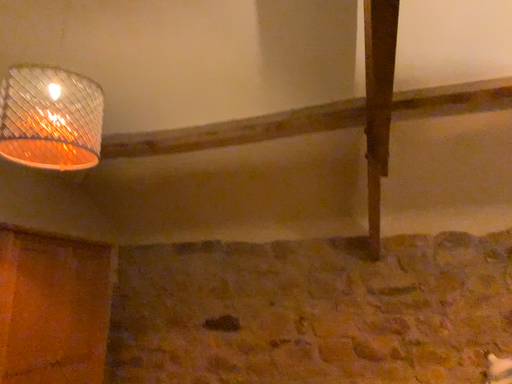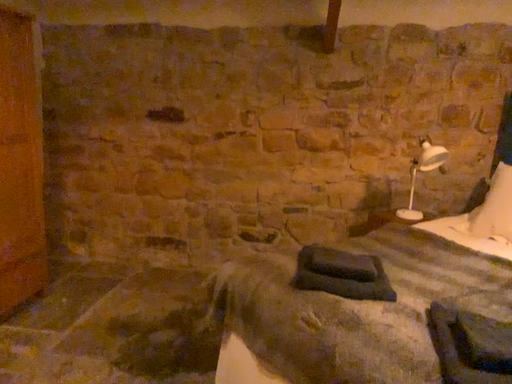
Question: How did the camera likely rotate when shooting the video?

Choices:
 (A) rotated upward
 (B) rotated downward

Answer: (B)